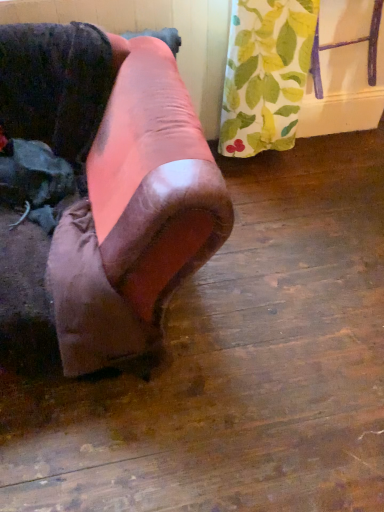
Question: Is point (89, 93) positioned closer to the camera than point (319, 76)?

Choices:
 (A) farther
 (B) closer

Answer: (B)

Question: From a real-world perspective, relative to green leaf-patterned curtain at upper right, acting as the 1th furniture starting from the right, is leather couch at left, acting as the second furniture starting from the right, vertically above or below?

Choices:
 (A) below
 (B) above

Answer: (A)

Question: Considering the relative positions of leather couch at left, marked as the 2th furniture in a top-to-bottom arrangement, and green leaf-patterned curtain at upper right, which is the 2th furniture in left-to-right order, in the image provided, is leather couch at left, marked as the 2th furniture in a top-to-bottom arrangement, to the left or to the right of green leaf-patterned curtain at upper right, which is the 2th furniture in left-to-right order,?

Choices:
 (A) right
 (B) left

Answer: (B)

Question: From a real-world perspective, is green leaf-patterned curtain at upper right, which appears as the 1th furniture when viewed from the top, positioned above or below leather couch at left, which is the 1th furniture in left-to-right order?

Choices:
 (A) below
 (B) above

Answer: (B)

Question: Considering the positions of point (377, 5) and point (218, 198), is point (377, 5) closer or farther from the camera than point (218, 198)?

Choices:
 (A) farther
 (B) closer

Answer: (A)

Question: Is green leaf-patterned curtain at upper right, which is the 2th furniture in left-to-right order, bigger or smaller than leather couch at left, which is the 1th furniture in left-to-right order?

Choices:
 (A) big
 (B) small

Answer: (B)

Question: In terms of height, does green leaf-patterned curtain at upper right, which appears as the 1th furniture when viewed from the top, look taller or shorter compared to leather couch at left, which appears as the first furniture when ordered from the bottom?

Choices:
 (A) tall
 (B) short

Answer: (B)